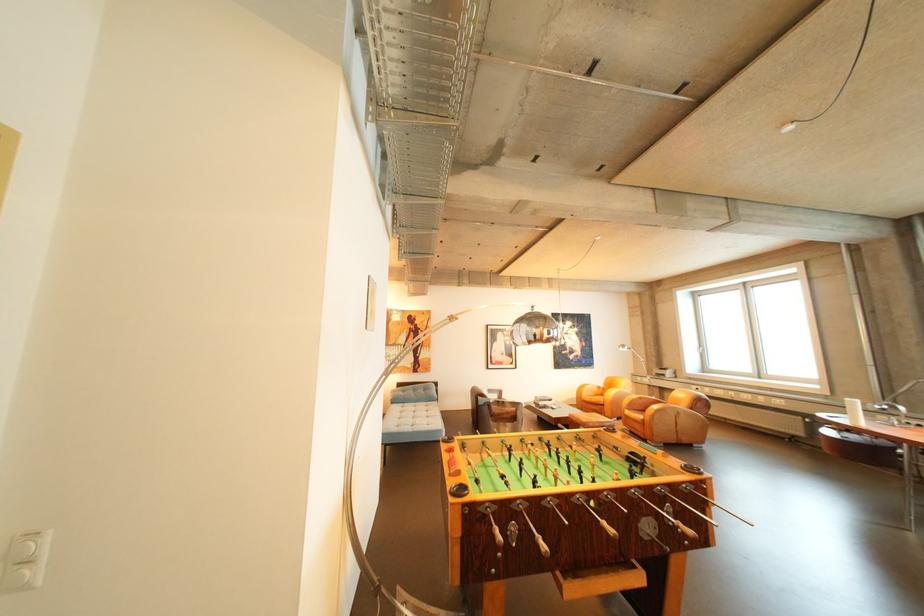
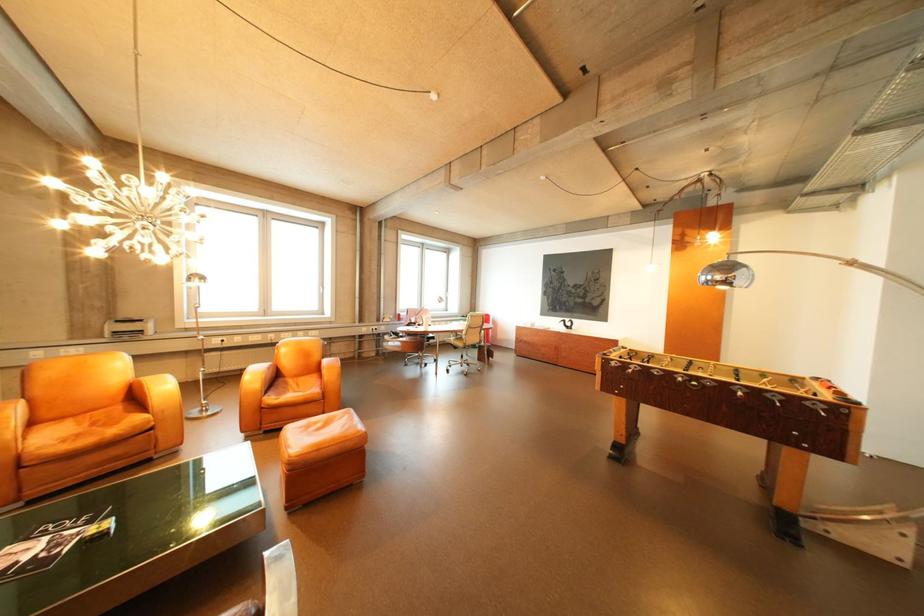
In the second image, find the point that corresponds to point (640, 413) in the first image.

(285, 400)